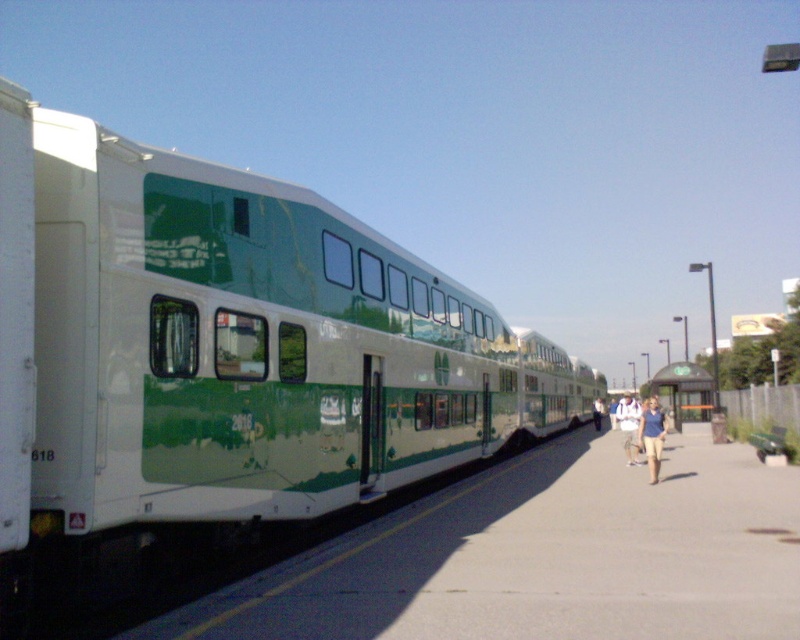
Consider the image. You are a passenger waiting at the train station and you see the green matte bus stop at center and the light blue jeans at center. Which object is closer to you?

The green matte bus stop at center is closer to you because the light blue jeans at center is behind it.

You are standing at the point marked by the coordinates point (652,435) in the train station scene. What object is exactly at your current position?

The blue cotton shirt at center is located at point (652,435).

You are a passenger waiting at the train station platform. You see two people wearing shirts at the center of the platform. Which shirt is nearer to you, the blue cotton shirt at center or the light blue shirt at center?

The blue cotton shirt at center is closer to the viewer than the light blue shirt at center, so the blue cotton shirt at center is nearer to you.